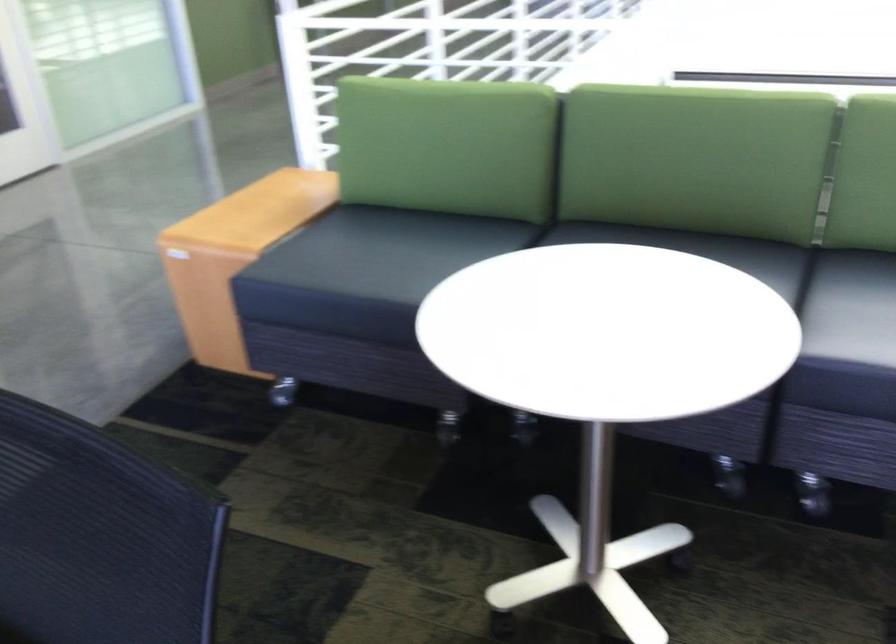
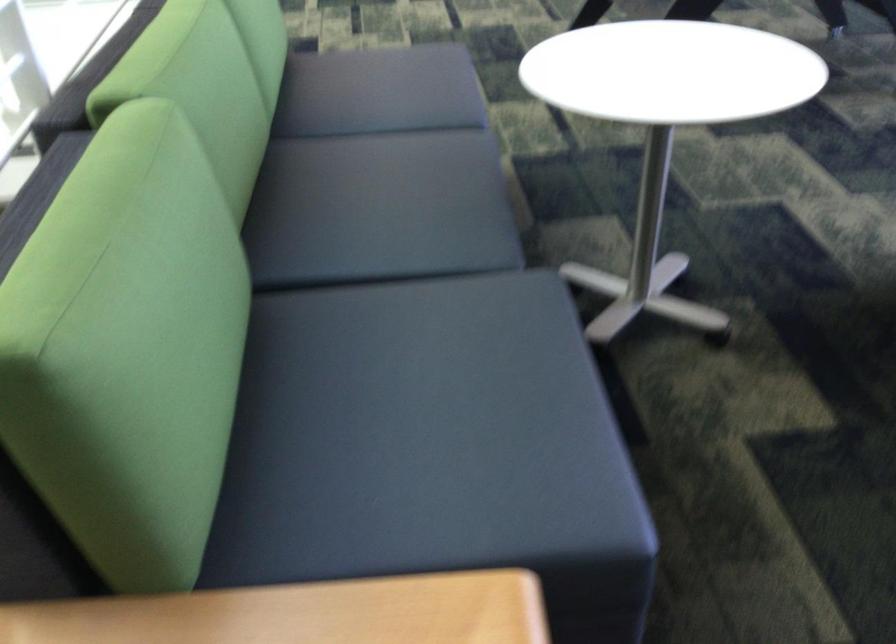
Find the pixel in the second image that matches pixel 358 243 in the first image.

(423, 438)